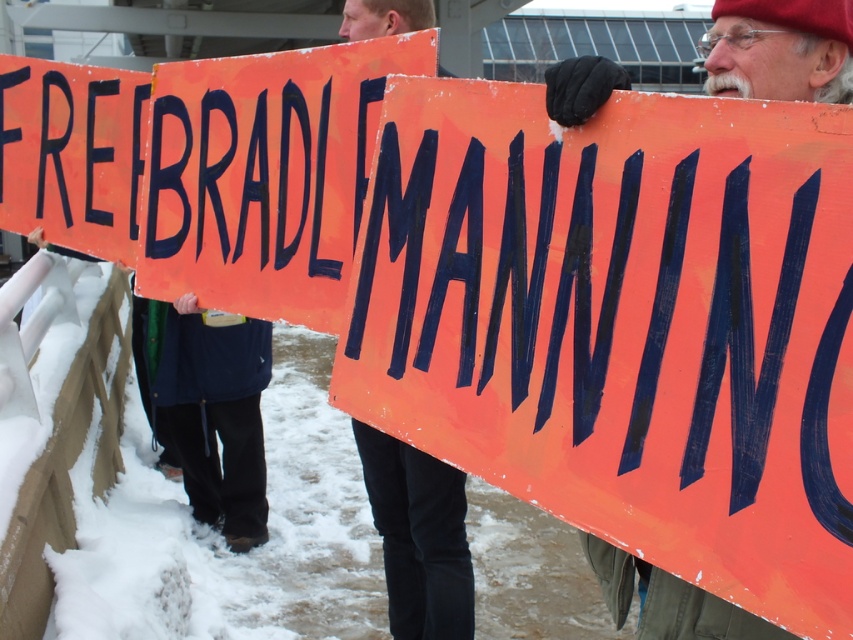
Can you confirm if orange painted wood sign at upper left is bigger than dark blue fleece pants at lower left?

Incorrect, orange painted wood sign at upper left is not larger than dark blue fleece pants at lower left.

Who is more distant from viewer, (137, 109) or (260, 344)?

The point (260, 344) is more distant.

Image resolution: width=853 pixels, height=640 pixels. Identify the location of orange painted wood sign at upper left. (73, 154).

Who is positioned more to the left, orange painted wood sign at center or matte orange sign at center?

Positioned to the left is orange painted wood sign at center.

The height and width of the screenshot is (640, 853). Describe the element at coordinates (265, 176) in the screenshot. I see `orange painted wood sign at center` at that location.

The image size is (853, 640). Describe the element at coordinates (265, 176) in the screenshot. I see `orange painted wood sign at center` at that location.

Find the location of a particular element. The image size is (853, 640). orange painted wood sign at center is located at coordinates [x=265, y=176].

Can you confirm if orange painted wood sign at center is thinner than orange painted wood sign at upper left?

In fact, orange painted wood sign at center might be wider than orange painted wood sign at upper left.

Does point (265, 144) come farther from viewer compared to point (146, 100)?

No.

The image size is (853, 640). I want to click on orange painted wood sign at center, so click(265, 176).